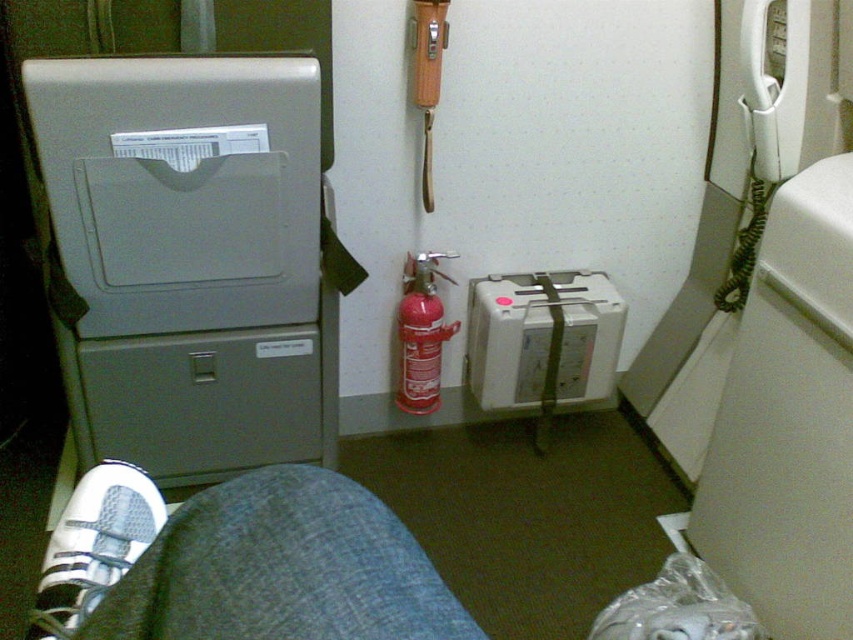
Is white plastic toilet at right smaller than white mesh shoe at lower left?

Actually, white plastic toilet at right might be larger than white mesh shoe at lower left.

Which of these two, white plastic toilet at right or white mesh shoe at lower left, stands shorter?

white mesh shoe at lower left is shorter.

Between point (838, 188) and point (128, 531), which one is positioned behind?

The point (838, 188) is more distant.

Identify the location of white plastic toilet at right. (788, 420).

Which of these two, white plastic box at center or white mesh shoe at lower left, stands shorter?

white mesh shoe at lower left

Who is more forward, [502,305] or [128,512]?

Point [128,512] is in front.

Where is `white plastic box at center`? The width and height of the screenshot is (853, 640). white plastic box at center is located at coordinates (508, 340).

Which of these two, white plastic box at center or red matte fire extinguisher at center, stands taller?

Standing taller between the two is red matte fire extinguisher at center.

Does point (610, 316) come closer to viewer compared to point (427, 321)?

No.

Is point (592, 300) in front of point (421, 404)?

Yes, it is in front of point (421, 404).

This screenshot has width=853, height=640. I want to click on white plastic box at center, so point(508,340).